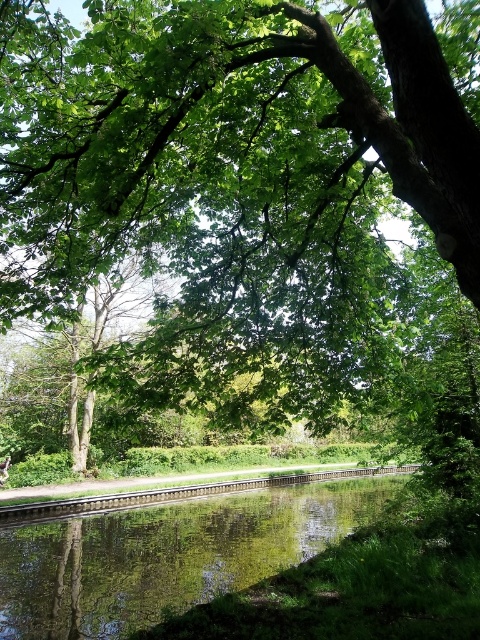
Question: Does green reflective water at center appear on the right side of green wooden train track at center?

Choices:
 (A) no
 (B) yes

Answer: (A)

Question: Observing the image, what is the correct spatial positioning of green reflective water at center in reference to green wooden train track at center?

Choices:
 (A) left
 (B) right

Answer: (A)

Question: Which object appears farthest from the camera in this image?

Choices:
 (A) green reflective water at center
 (B) green wooden train track at center

Answer: (B)

Question: Which point is closer to the camera?

Choices:
 (A) green reflective water at center
 (B) green wooden train track at center

Answer: (A)

Question: Which object is closer to the camera taking this photo?

Choices:
 (A) green wooden train track at center
 (B) green reflective water at center

Answer: (B)

Question: Is green reflective water at center above green wooden train track at center?

Choices:
 (A) no
 (B) yes

Answer: (B)